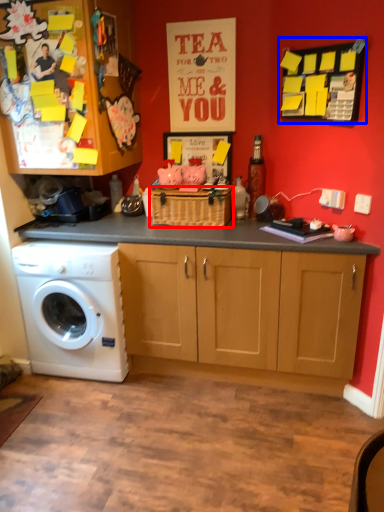
Question: Which of the following is the closest to the observer, basket (highlighted by a red box) or bulletin board (highlighted by a blue box)?

Choices:
 (A) basket
 (B) bulletin board

Answer: (B)